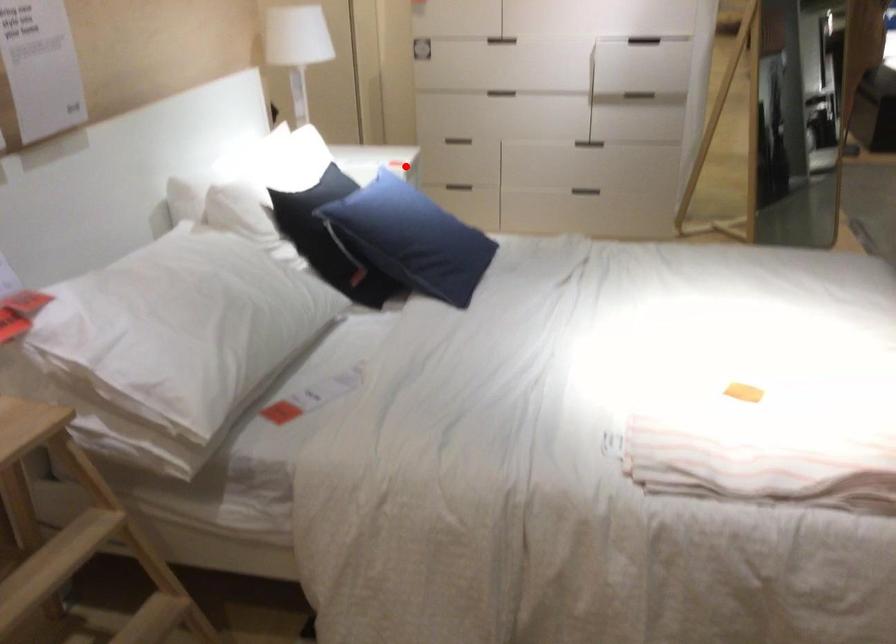
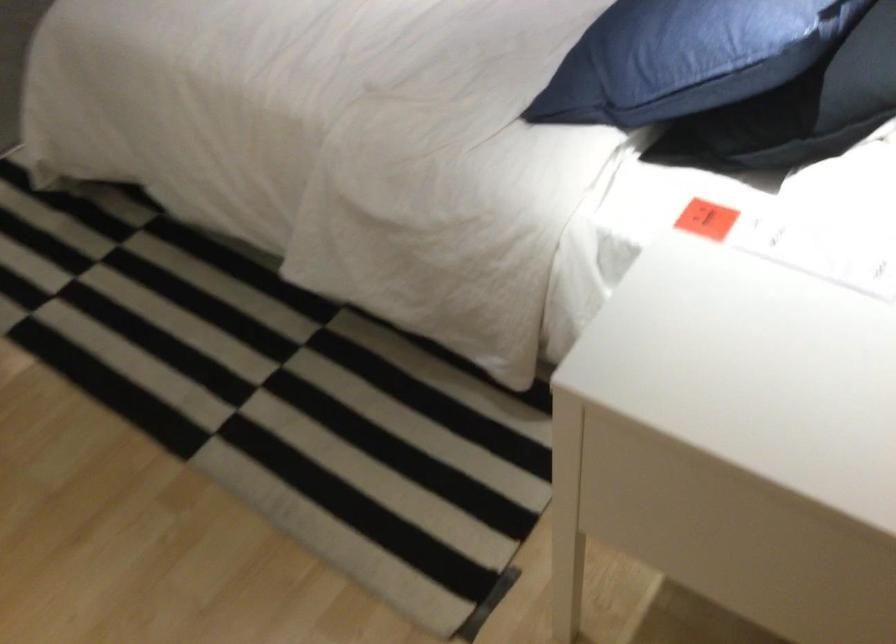
Find the pixel in the second image that matches the highlighted location in the first image.

(707, 219)